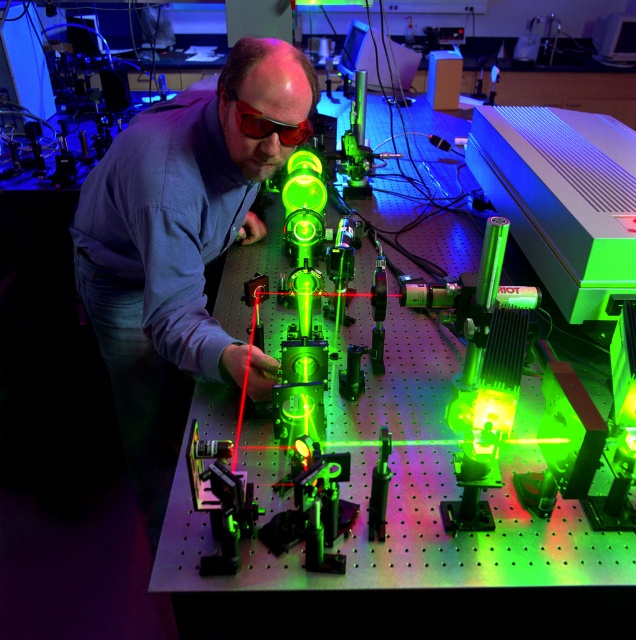
Question: Which point appears farthest from the camera in this image?

Choices:
 (A) (169, 163)
 (B) (237, 113)

Answer: (A)

Question: Observing the image, what is the correct spatial positioning of matte black shirt at center in reference to red plastic glasses at center?

Choices:
 (A) above
 (B) below

Answer: (B)

Question: Which object appears farthest from the camera in this image?

Choices:
 (A) red plastic glasses at center
 (B) matte black shirt at center

Answer: (B)

Question: Is matte black shirt at center thinner than red plastic glasses at center?

Choices:
 (A) no
 (B) yes

Answer: (A)

Question: Is matte black shirt at center above red plastic glasses at center?

Choices:
 (A) no
 (B) yes

Answer: (A)